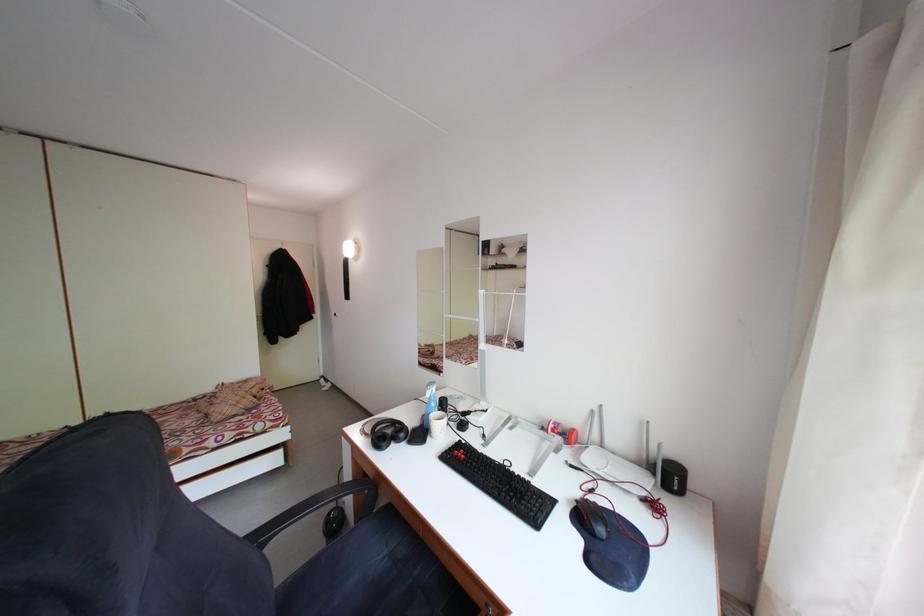
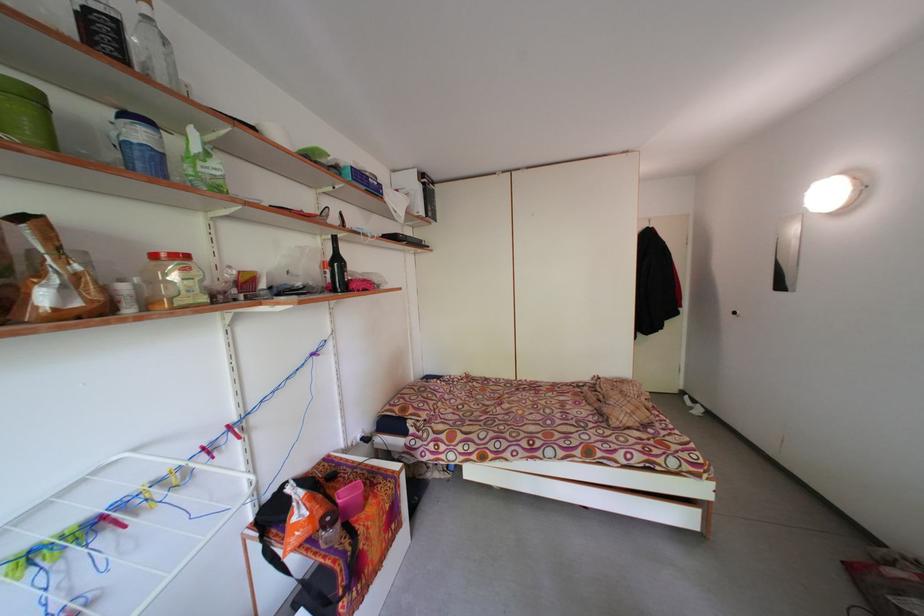
Question: Based on the continuous images, in which direction is the camera rotating? Reply with the corresponding letter.

Choices:
 (A) Left
 (B) Right
 (C) Up
 (D) Down

Answer: (A)